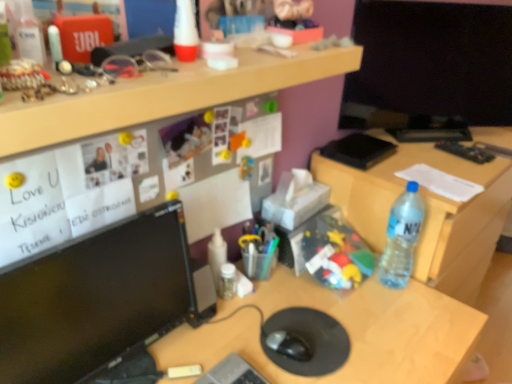
The width and height of the screenshot is (512, 384). I want to click on unoccupied area behind black rubber mousepad at center, so click(309, 291).